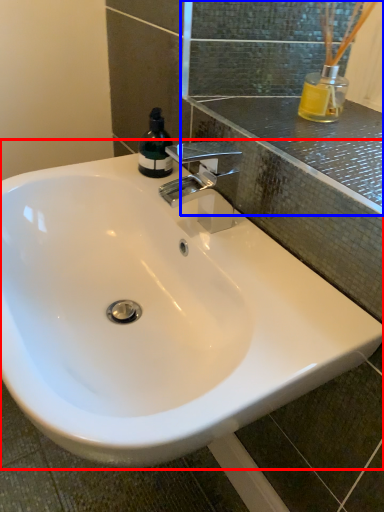
Question: Which object appears closest to the camera in this image, sink (highlighted by a red box) or mirror (highlighted by a blue box)?

Choices:
 (A) sink
 (B) mirror

Answer: (A)